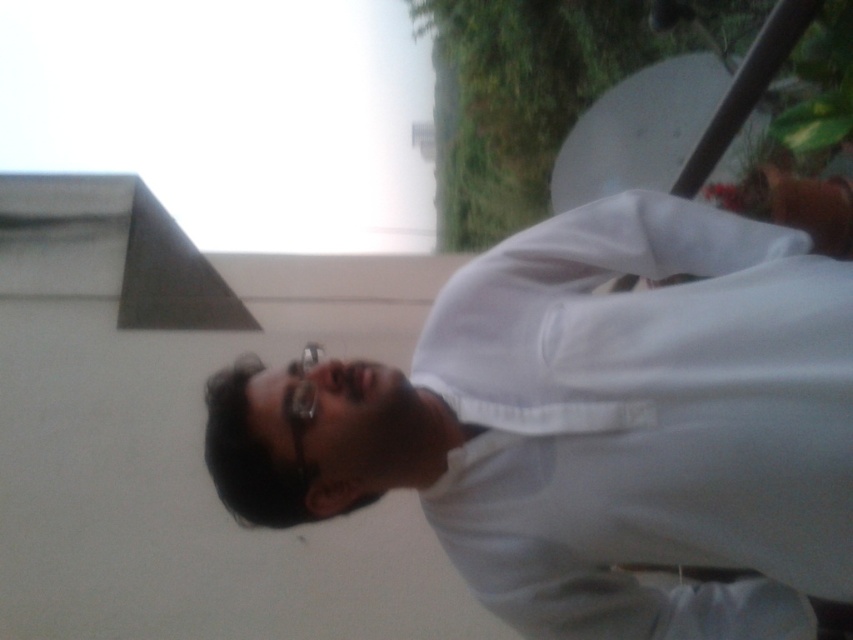
Is white matte shirt at center positioned at the back of semi-transparent plastic glasses at center?

No, it is not.

The image size is (853, 640). Find the location of `white matte shirt at center`. white matte shirt at center is located at coordinates (593, 426).

Find the location of a particular element. Image resolution: width=853 pixels, height=640 pixels. white matte shirt at center is located at coordinates 593,426.